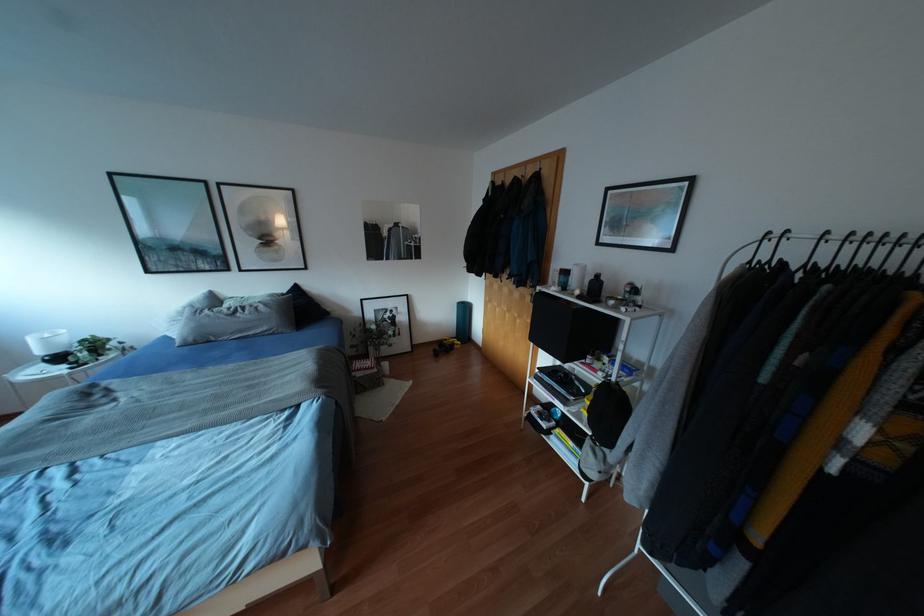
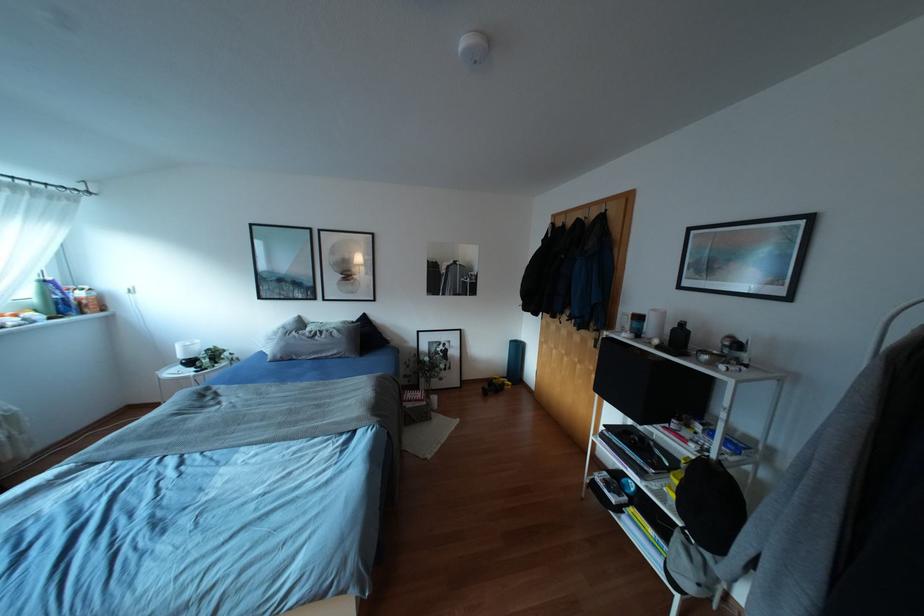
Find the pixel in the second image that matches point (44, 362) in the first image.

(180, 363)